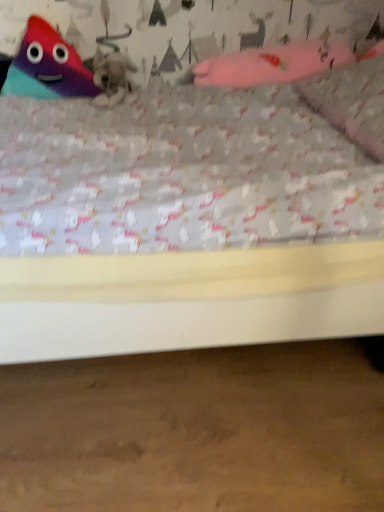
Where is `pink fabric pillow at upper right`? The width and height of the screenshot is (384, 512). pink fabric pillow at upper right is located at coordinates (351, 102).

At what (x,y) coordinates should I click in order to perform the action: click on pink fabric glove at upper right, which ranks as the 1th toy in right-to-left order. Please return your answer as a coordinate pair (x, y). The image size is (384, 512). Looking at the image, I should click on pos(278,63).

Measure the distance between point [268,52] and camera.

Point [268,52] and camera are 4.51 feet apart from each other.

Describe the element at coordinates (111, 77) in the screenshot. I see `fuzzy gray cat at upper center` at that location.

Image resolution: width=384 pixels, height=512 pixels. In order to click on pink fabric pillow at upper right in this screenshot , I will do `click(351, 102)`.

Does fuzzy gray cat at upper center contain pink fabric pillow at upper right?

Actually, pink fabric pillow at upper right is outside fuzzy gray cat at upper center.

Considering the relative positions of fuzzy gray cat at upper center and pink fabric pillow at upper right in the image provided, is fuzzy gray cat at upper center to the right of pink fabric pillow at upper right from the viewer's perspective?

No, fuzzy gray cat at upper center is not to the right of pink fabric pillow at upper right.

Is pink fabric pillow at upper right at the back of fuzzy gray cat at upper center?

No.

Based on the photo, from a real-world perspective, is fuzzy gray cat at upper center located higher than pink fabric pillow at upper right?

Actually, fuzzy gray cat at upper center is physically below pink fabric pillow at upper right in the real world.

Find the location of a particular element. The image size is (384, 512). pillow that is on the right side of matte plastic triangle at upper left, the 1th toy viewed from the left is located at coordinates (351, 102).

Between matte plastic triangle at upper left, which appears as the 2th toy when viewed from the right, and pink fabric pillow at upper right, which one has smaller width?

matte plastic triangle at upper left, which appears as the 2th toy when viewed from the right, is thinner.

Are matte plastic triangle at upper left, the 1th toy viewed from the left, and pink fabric pillow at upper right making contact?

No, matte plastic triangle at upper left, the 1th toy viewed from the left, is not beside pink fabric pillow at upper right.

Is pink fabric pillow at upper right surrounded by matte plastic triangle at upper left, the 1th toy viewed from the left?

No, pink fabric pillow at upper right is not surrounded by matte plastic triangle at upper left, the 1th toy viewed from the left.

Considering the relative positions of pink fabric glove at upper right, the second toy from the left, and fuzzy gray cat at upper center in the image provided, is pink fabric glove at upper right, the second toy from the left, to the left of fuzzy gray cat at upper center from the viewer's perspective?

Incorrect, pink fabric glove at upper right, the second toy from the left, is not on the left side of fuzzy gray cat at upper center.

In terms of height, does pink fabric glove at upper right, the second toy from the left, look taller or shorter compared to fuzzy gray cat at upper center?

Clearly, pink fabric glove at upper right, the second toy from the left, is taller compared to fuzzy gray cat at upper center.

Identify the location of toy that is the 1st one above the fuzzy gray cat at upper center (from a real-world perspective). (278, 63).

Is pink fabric pillow at upper right looking in the opposite direction of matte plastic triangle at upper left, the 1th toy viewed from the left?

pink fabric pillow at upper right is not turned away from matte plastic triangle at upper left, the 1th toy viewed from the left.

Relative to matte plastic triangle at upper left, the 1th toy viewed from the left, is pink fabric pillow at upper right in front or behind?

Visually, pink fabric pillow at upper right is located in front of matte plastic triangle at upper left, the 1th toy viewed from the left.

From a real-world perspective, which object rests below the other?

From a 3D spatial view, pink fabric pillow at upper right is below.

From the image's perspective, is pink fabric pillow at upper right located above or below matte plastic triangle at upper left, the 1th toy viewed from the left?

Clearly, from the image's perspective, pink fabric pillow at upper right is below matte plastic triangle at upper left, the 1th toy viewed from the left.

Is pink fabric pillow at upper right oriented towards pink fabric glove at upper right, the second toy from the left?

No, pink fabric pillow at upper right is not oriented towards pink fabric glove at upper right, the second toy from the left.

Is pink fabric pillow at upper right shorter than pink fabric glove at upper right, the second toy from the left?

Indeed, pink fabric pillow at upper right has a lesser height compared to pink fabric glove at upper right, the second toy from the left.

From a real-world perspective, which object rests below the other?

From a 3D spatial view, pink fabric pillow at upper right is below.

Between pink fabric pillow at upper right and pink fabric glove at upper right, which ranks as the 1th toy in right-to-left order, which one has larger size?

pink fabric glove at upper right, which ranks as the 1th toy in right-to-left order, is bigger.

Which of these two, matte plastic triangle at upper left, the 1th toy viewed from the left, or pink fabric glove at upper right, the second toy from the left, stands shorter?

pink fabric glove at upper right, the second toy from the left, is shorter.

Considering the sizes of objects matte plastic triangle at upper left, the 1th toy viewed from the left, and pink fabric glove at upper right, the second toy from the left, in the image provided, who is bigger, matte plastic triangle at upper left, the 1th toy viewed from the left, or pink fabric glove at upper right, the second toy from the left,?

pink fabric glove at upper right, the second toy from the left, is bigger.

Which object is more forward, matte plastic triangle at upper left, which appears as the 2th toy when viewed from the right, or pink fabric glove at upper right, which ranks as the 1th toy in right-to-left order?

pink fabric glove at upper right, which ranks as the 1th toy in right-to-left order, is in front.

How distant is matte plastic triangle at upper left, the 1th toy viewed from the left, from pink fabric glove at upper right, the second toy from the left?

matte plastic triangle at upper left, the 1th toy viewed from the left, is 20.05 inches from pink fabric glove at upper right, the second toy from the left.

Considering the positions of objects pink fabric glove at upper right, which ranks as the 1th toy in right-to-left order, and pink fabric pillow at upper right in the image provided, who is more to the right, pink fabric glove at upper right, which ranks as the 1th toy in right-to-left order, or pink fabric pillow at upper right?

pink fabric pillow at upper right is more to the right.

From the image's perspective, which is above, pink fabric glove at upper right, which ranks as the 1th toy in right-to-left order, or pink fabric pillow at upper right?

pink fabric glove at upper right, which ranks as the 1th toy in right-to-left order, is shown above in the image.

Is pink fabric glove at upper right, the second toy from the left, directly adjacent to pink fabric pillow at upper right?

No, pink fabric glove at upper right, the second toy from the left, is not beside pink fabric pillow at upper right.

Is pink fabric glove at upper right, the second toy from the left, positioned with its back to pink fabric pillow at upper right?

No, pink fabric glove at upper right, the second toy from the left, is not facing away from pink fabric pillow at upper right.

Identify the location of pillow below the fuzzy gray cat at upper center (from the image's perspective). (351, 102).

Locate an element on the screen. This screenshot has height=512, width=384. pillow that appears on the right of matte plastic triangle at upper left, the 1th toy viewed from the left is located at coordinates (351, 102).

Which object lies nearer to the anchor point pink fabric pillow at upper right, pink fabric glove at upper right, which ranks as the 1th toy in right-to-left order, or fuzzy gray cat at upper center?

pink fabric glove at upper right, which ranks as the 1th toy in right-to-left order, is closer to pink fabric pillow at upper right.

From the image, which object appears to be nearer to pink fabric glove at upper right, which ranks as the 1th toy in right-to-left order, matte plastic triangle at upper left, the 1th toy viewed from the left, or pink fabric pillow at upper right?

Based on the image, pink fabric pillow at upper right appears to be nearer to pink fabric glove at upper right, which ranks as the 1th toy in right-to-left order.

Considering their positions, is fuzzy gray cat at upper center positioned closer to pink fabric pillow at upper right than pink fabric glove at upper right, the second toy from the left?

Based on the image, pink fabric glove at upper right, the second toy from the left, appears to be nearer to pink fabric pillow at upper right.

From the image, which object appears to be farther from matte plastic triangle at upper left, the 1th toy viewed from the left, pink fabric glove at upper right, the second toy from the left, or fuzzy gray cat at upper center?

Based on the image, pink fabric glove at upper right, the second toy from the left, appears to be further to matte plastic triangle at upper left, the 1th toy viewed from the left.

When comparing their distances from pink fabric glove at upper right, the second toy from the left, does pink fabric pillow at upper right or fuzzy gray cat at upper center seem closer?

pink fabric pillow at upper right lies closer to pink fabric glove at upper right, the second toy from the left, than the other object.

Estimate the real-world distances between objects in this image. Which object is closer to matte plastic triangle at upper left, the 1th toy viewed from the left, fuzzy gray cat at upper center or pink fabric glove at upper right, the second toy from the left?

fuzzy gray cat at upper center lies closer to matte plastic triangle at upper left, the 1th toy viewed from the left, than the other object.

Estimate the real-world distances between objects in this image. Which object is closer to pink fabric pillow at upper right, fuzzy gray cat at upper center or matte plastic triangle at upper left, the 1th toy viewed from the left?

fuzzy gray cat at upper center lies closer to pink fabric pillow at upper right than the other object.

Considering their positions, is pink fabric pillow at upper right positioned closer to fuzzy gray cat at upper center than pink fabric glove at upper right, the second toy from the left?

pink fabric glove at upper right, the second toy from the left, lies closer to fuzzy gray cat at upper center than the other object.

The height and width of the screenshot is (512, 384). Identify the location of animal between matte plastic triangle at upper left, which appears as the 2th toy when viewed from the right, and pink fabric glove at upper right, the second toy from the left, in the horizontal direction. (111, 77).

Where is `toy between fuzzy gray cat at upper center and pink fabric pillow at upper right from left to right`? The height and width of the screenshot is (512, 384). toy between fuzzy gray cat at upper center and pink fabric pillow at upper right from left to right is located at coordinates (278, 63).

Find the location of a particular element. Image resolution: width=384 pixels, height=512 pixels. toy located between matte plastic triangle at upper left, the 1th toy viewed from the left, and pink fabric pillow at upper right in the left-right direction is located at coordinates (278, 63).

The image size is (384, 512). I want to click on animal between matte plastic triangle at upper left, the 1th toy viewed from the left, and pink fabric pillow at upper right, so pos(111,77).